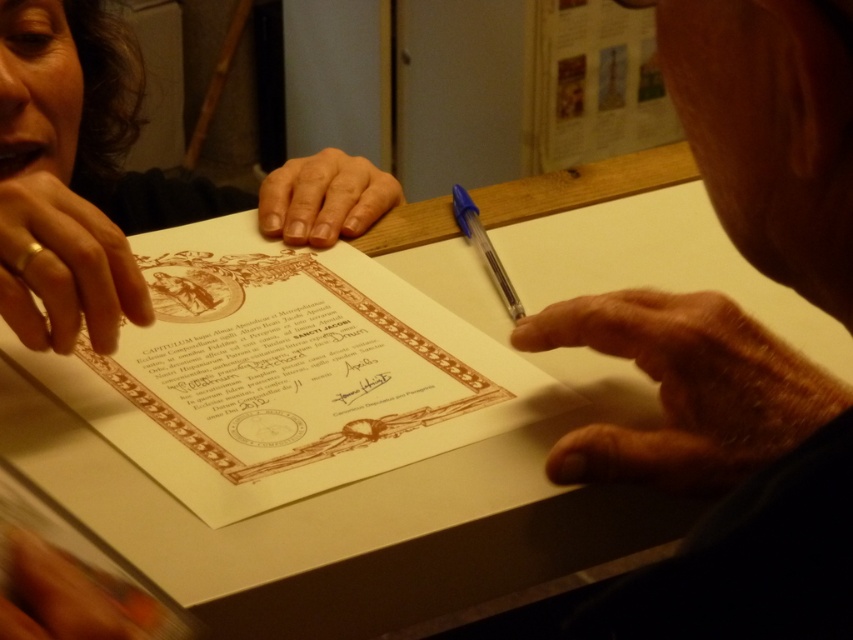
Is point (82, 209) positioned before point (289, 179)?

Yes, it is in front of point (289, 179).

Is gold ring at left to the right of smooth skin hand at center from the viewer's perspective?

In fact, gold ring at left is to the left of smooth skin hand at center.

Does point (19, 173) lie behind point (341, 228)?

That is True.

Find the location of a particular element. The image size is (853, 640). gold ring at left is located at coordinates (64, 266).

Does smooth skin hand at upper right have a lesser height compared to smooth skin hand at center?

No, smooth skin hand at upper right is not shorter than smooth skin hand at center.

Who is taller, smooth skin hand at upper right or smooth skin hand at center?

smooth skin hand at upper right

Where is `smooth skin hand at upper right`? The height and width of the screenshot is (640, 853). smooth skin hand at upper right is located at coordinates pos(717,467).

Who is positioned more to the left, smooth skin hand at upper right or gold ring at left?

gold ring at left is more to the left.

Is smooth skin hand at upper right behind gold ring at left?

That is False.

Between point (740, 605) and point (26, 202), which one is positioned behind?

The point (26, 202) is behind.

I want to click on smooth skin hand at upper right, so (717, 467).